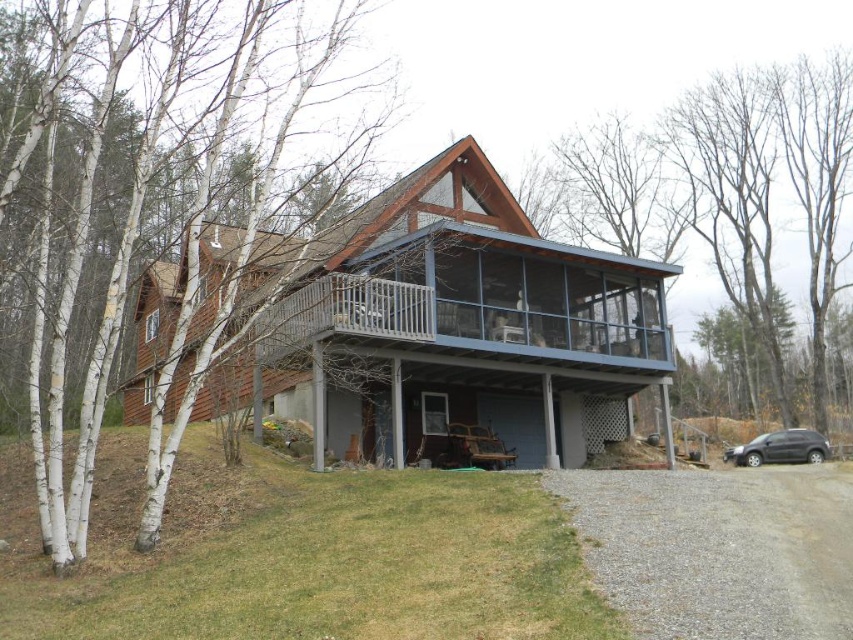
You are standing at the point marked by point (x=486, y=310) in the image. What object is located exactly at that point?

The point (x=486, y=310) marks the brown wood cabin at center.

You are standing in front of the house and notice a point marked at coordinates (x=200, y=218). Which object does this point correspond to?

The point at (x=200, y=218) corresponds to the white bark tree at left.